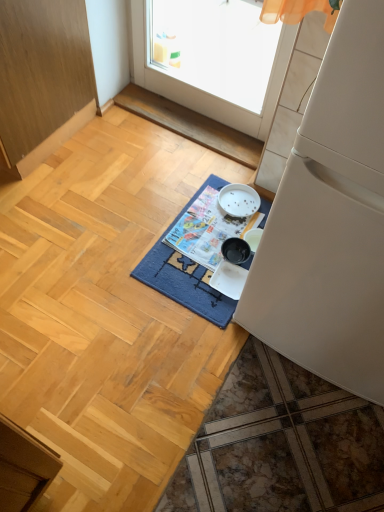
Find the location of `free space above blue woven mat at center (from a real-world perspective)`. free space above blue woven mat at center (from a real-world perspective) is located at coordinates point(215,238).